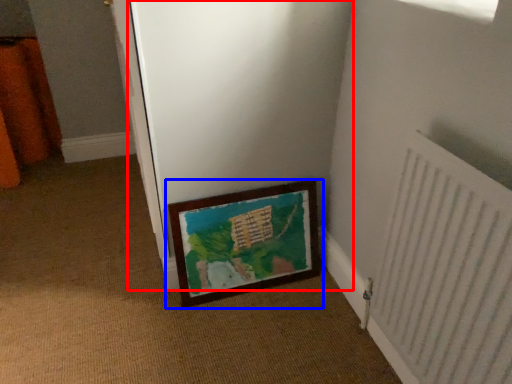
Question: Which point is further to the camera, screen door (highlighted by a red box) or picture frame (highlighted by a blue box)?

Choices:
 (A) screen door
 (B) picture frame

Answer: (B)